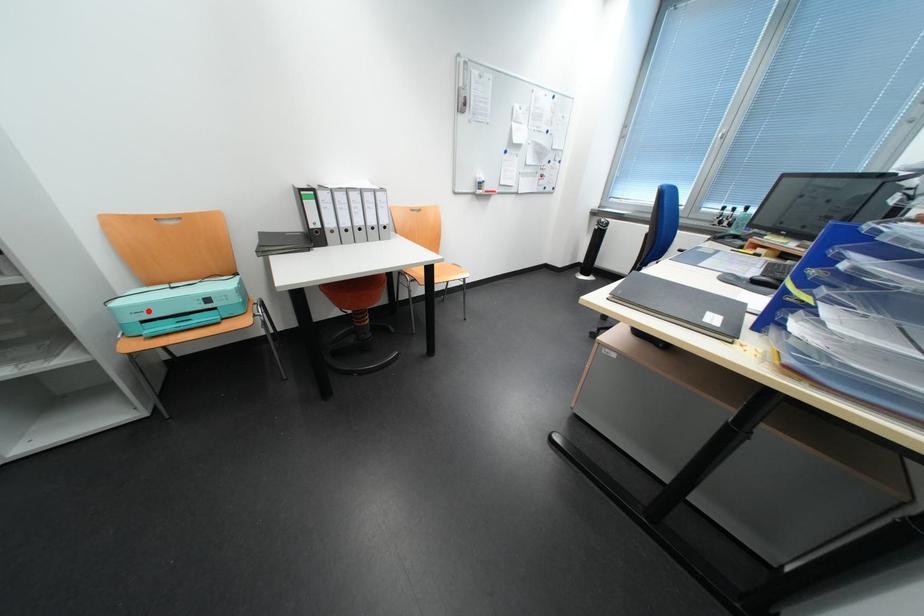
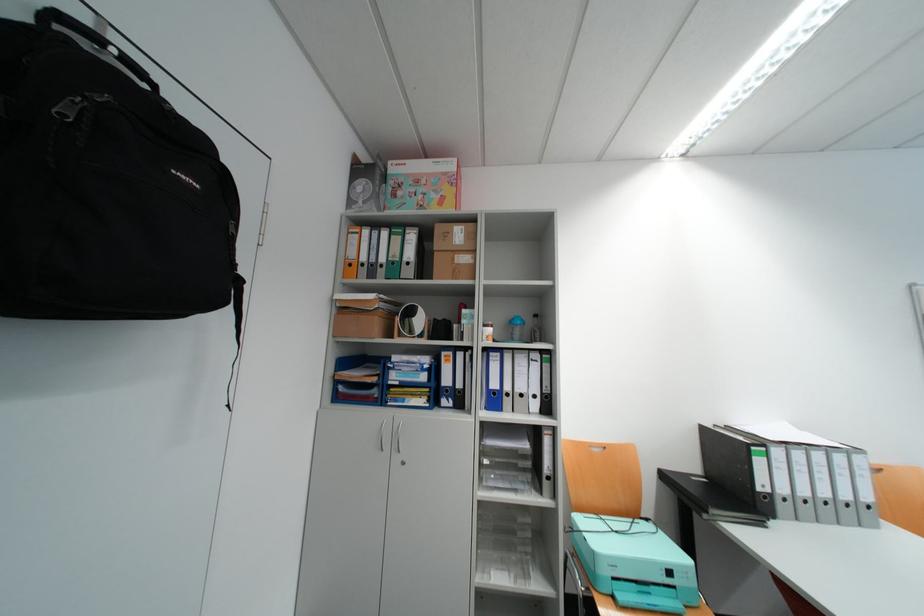
The point at the highlighted location is marked in the first image. Where is the corresponding point in the second image?

(624, 562)